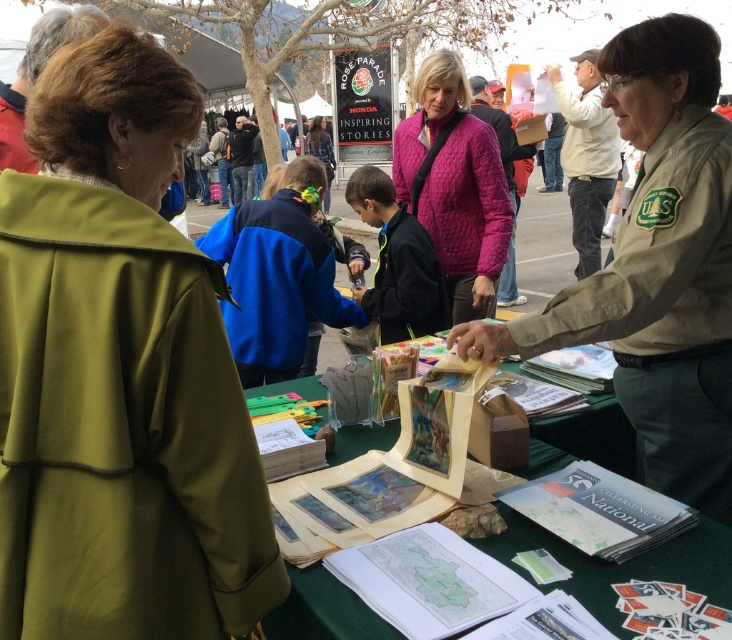
Is blue fleece jacket at center below pink quilted jacket at center?

Indeed, blue fleece jacket at center is positioned under pink quilted jacket at center.

Can you confirm if blue fleece jacket at center is thinner than pink quilted jacket at center?

No, blue fleece jacket at center is not thinner than pink quilted jacket at center.

What are the coordinates of `blue fleece jacket at center` in the screenshot? It's located at (277, 275).

Image resolution: width=732 pixels, height=640 pixels. I want to click on blue fleece jacket at center, so click(277, 275).

Between matte olive green coat at left and khaki uniform at center, which one is positioned lower?

matte olive green coat at left

Is point (173, 298) positioned in front of point (709, 435)?

Yes.

I want to click on matte olive green coat at left, so [119, 374].

Locate an element on the screen. The height and width of the screenshot is (640, 732). matte olive green coat at left is located at coordinates (119, 374).

Can you confirm if khaki uniform at center is bigger than matte paper bag at center?

Yes.

Which of these two, khaki uniform at center or matte paper bag at center, stands taller?

With more height is khaki uniform at center.

Who is more distant from viewer, (698, 60) or (709, 577)?

The point (698, 60) is more distant.

Locate an element on the screen. This screenshot has height=640, width=732. khaki uniform at center is located at coordinates (657, 268).